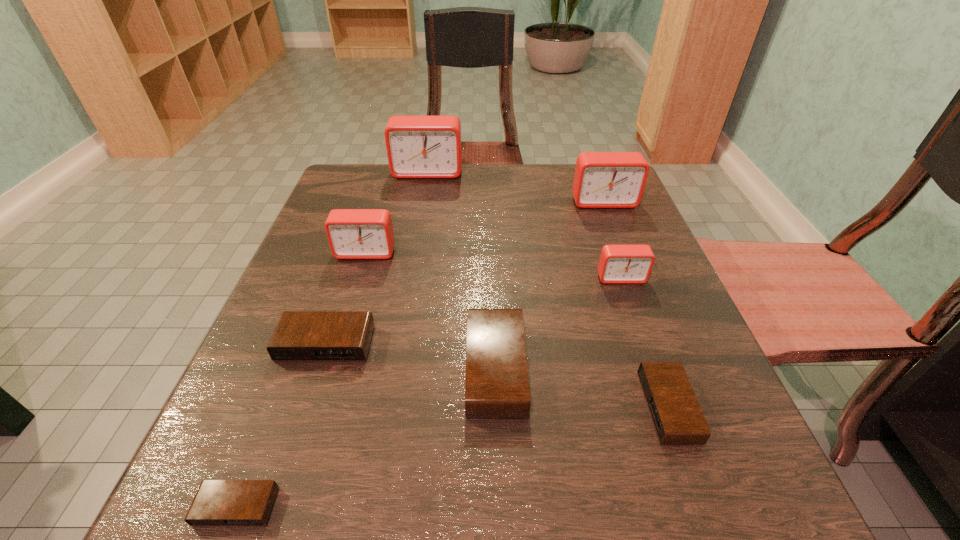
The image size is (960, 540). Identify the location of the farthest red alarm clock. (417, 146).

In order to click on the tallest object in this screenshot , I will do `click(417, 146)`.

At what (x,y) coordinates should I click in order to perform the action: click on the second tallest object. Please return your answer as a coordinate pair (x, y). The height and width of the screenshot is (540, 960). Looking at the image, I should click on (602, 179).

Locate an element on the screen. the second tallest alarm clock is located at coordinates (602, 179).

At what (x,y) coordinates should I click in order to perform the action: click on the second smallest red alarm clock. Please return your answer as a coordinate pair (x, y). This screenshot has width=960, height=540. Looking at the image, I should click on (352, 233).

Find the location of a particular element. the third farthest object is located at coordinates (352, 233).

Image resolution: width=960 pixels, height=540 pixels. In order to click on the fifth nearest object in this screenshot , I will do `click(619, 264)`.

Where is `the nearest red alarm clock`? Image resolution: width=960 pixels, height=540 pixels. the nearest red alarm clock is located at coordinates (619, 264).

At what (x,y) coordinates should I click in order to perform the action: click on the fourth object from right to left. Please return your answer as a coordinate pair (x, y). Looking at the image, I should click on (497, 385).

Find the location of a particular element. the third black alarm clock from left to right is located at coordinates (497, 385).